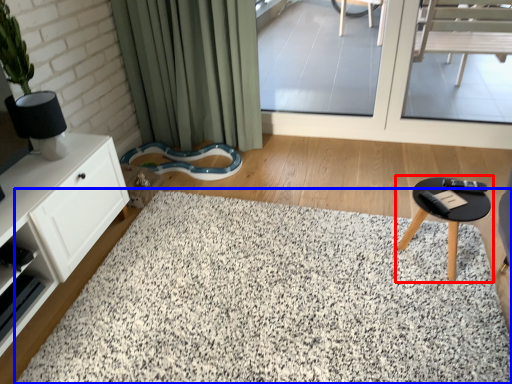
Question: Among these objects, which one is farthest to the camera, table (highlighted by a red box) or mat (highlighted by a blue box)?

Choices:
 (A) table
 (B) mat

Answer: (A)